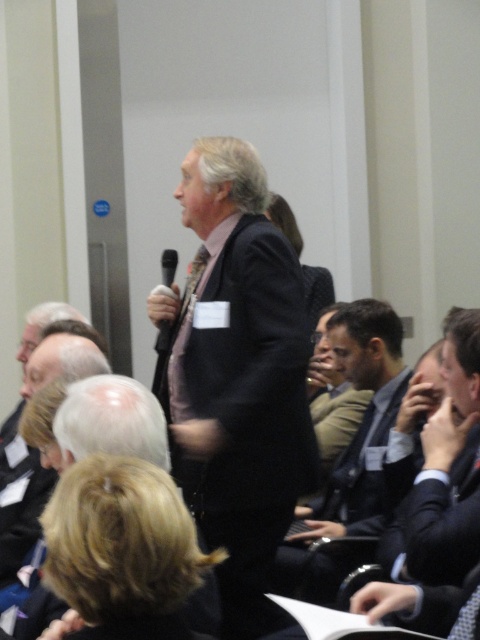
Does point (288, 266) come behind point (32, 348)?

No, (288, 266) is in front of (32, 348).

Can you confirm if dark suit at center is positioned below gray hair at lower left?

Yes, dark suit at center is below gray hair at lower left.

Does point (250, 280) come in front of point (17, 412)?

Yes.

Image resolution: width=480 pixels, height=640 pixels. Identify the location of dark suit at center. (237, 376).

The image size is (480, 640). Describe the element at coordinates (237, 376) in the screenshot. I see `dark suit at center` at that location.

Can you confirm if dark suit at center is positioned to the left of dark brown suit at center?

Indeed, dark suit at center is positioned on the left side of dark brown suit at center.

Between point (265, 428) and point (374, 301), which one is positioned in front?

Positioned in front is point (265, 428).

In order to click on dark suit at center in this screenshot , I will do `click(237, 376)`.

Is point (359, 371) farther from camera compared to point (39, 307)?

No, (359, 371) is closer to viewer.

Is point (334, 509) farther from camera compared to point (59, 307)?

That is False.

Identify the location of dark brown suit at center. (354, 435).